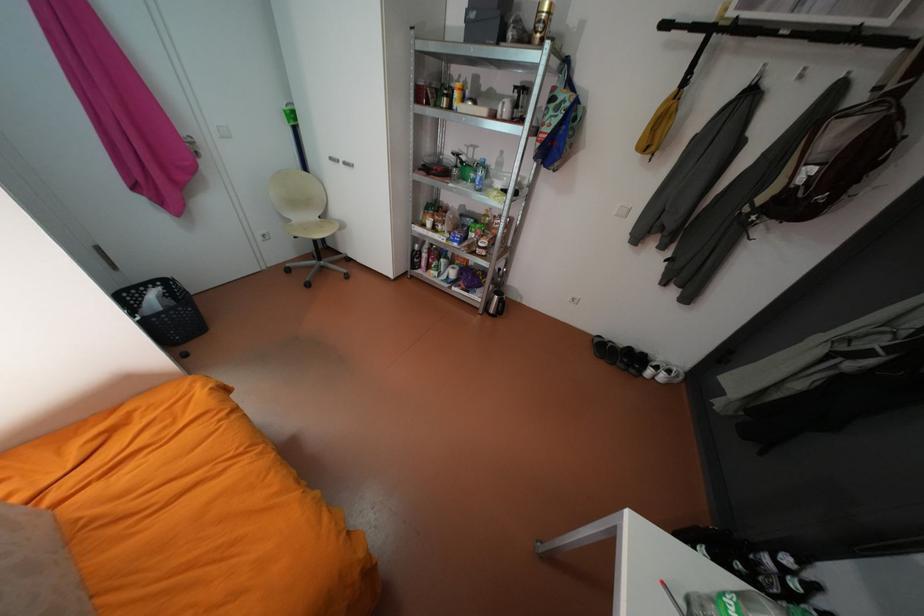
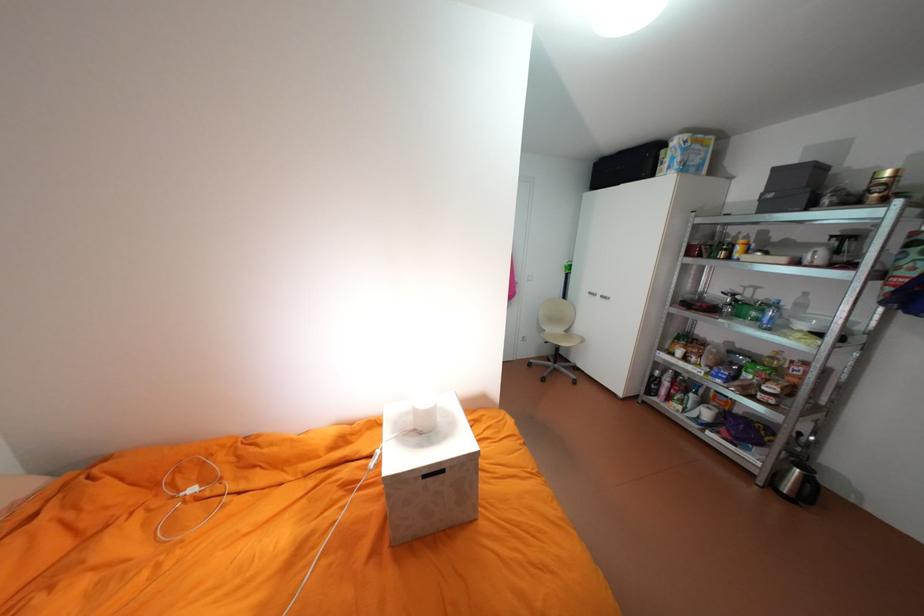
Based on the continuous images, in which direction is the camera rotating?

The camera's rotation is toward left-up.